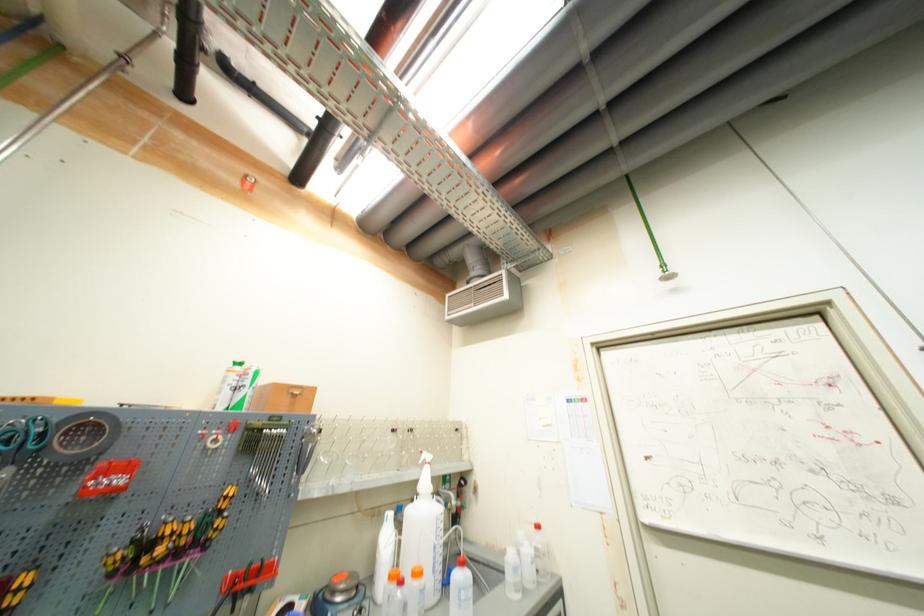
The location [23,438] corresponds to which object?

It corresponds to the blue handled scissors in the image.